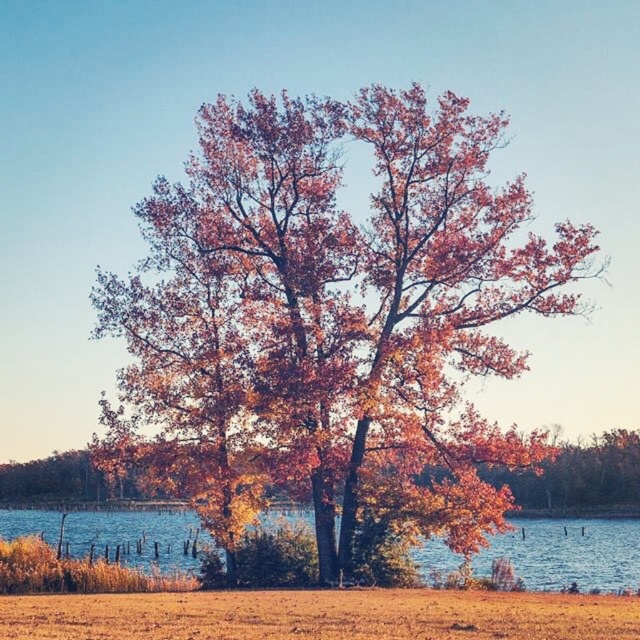
You are standing in the autumn scene and want to place a small decorative rock on the ground. If you place it on the autumn leaves wood at center, will it be above or below the brown grass at lower center?

The autumn leaves wood at center is positioned over the brown grass at lower center, so placing the rock on the autumn leaves wood at center would place it above the brown grass at lower center.

You are standing at the edge of the water and want to step onto the brown grass at lower center. Based on its position, can you estimate how far to the right or left you should move from your current position to reach it?

The brown grass at lower center is located at point 0.963 on the x and y axis, so you should move to the right and slightly forward to reach it.

You are planning to set up a small tent for a picnic in the area shown in the image. The tent requires a flat, open space that is larger than the brown grass at lower center. Can you determine if the autumn leaves wood at center would provide sufficient space for the tent?

The autumn leaves wood at center is bigger than brown grass at lower center. Since the tent requires a space larger than the brown grass at lower center, the autumn leaves wood at center would provide sufficient space for the tent.